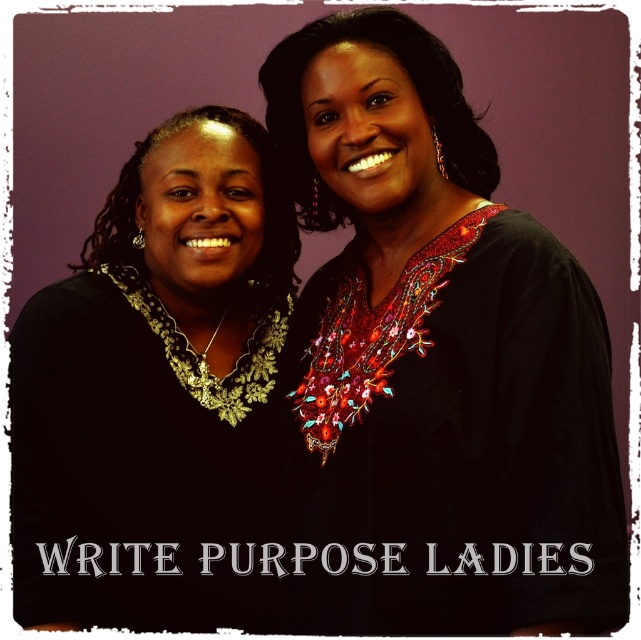
Question: Is matte black necklace at left positioned at the back of matte gold necklace at left?

Choices:
 (A) no
 (B) yes

Answer: (A)

Question: Which of the following is the closest to the observer?

Choices:
 (A) (279, 284)
 (B) (417, 33)
 (C) (378, 333)
 (D) (65, 490)

Answer: (C)

Question: In this image, where is black embroidered blouse at center located relative to matte black blouse at upper center?

Choices:
 (A) above
 (B) below

Answer: (B)

Question: Where is matte black necklace at left located in relation to matte gold necklace at left in the image?

Choices:
 (A) above
 (B) below

Answer: (B)

Question: Which point is farther from the camera taking this photo?

Choices:
 (A) (260, 278)
 (B) (444, 352)

Answer: (A)

Question: Which object is closer to the camera taking this photo?

Choices:
 (A) matte gold necklace at left
 (B) black embroidered blouse at center
 (C) matte black blouse at upper center
 (D) matte black necklace at left

Answer: (B)